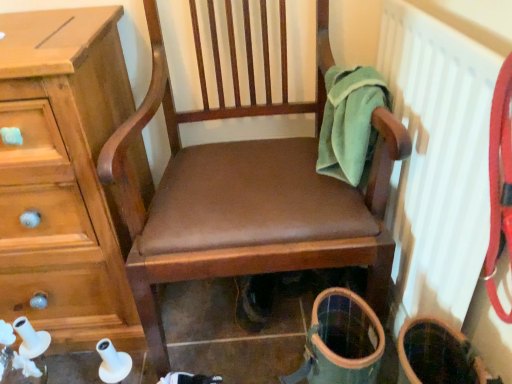
Question: Is brown leather chair at center shorter than green fleece towel at upper right?

Choices:
 (A) yes
 (B) no

Answer: (B)

Question: Can you confirm if brown leather chair at center is wider than green fleece towel at upper right?

Choices:
 (A) no
 (B) yes

Answer: (B)

Question: From the image's perspective, is brown leather chair at center located above green fleece towel at upper right?

Choices:
 (A) yes
 (B) no

Answer: (B)

Question: Is brown leather chair at center positioned with its back to green fleece towel at upper right?

Choices:
 (A) no
 (B) yes

Answer: (A)

Question: Could green fleece towel at upper right be considered to be inside brown leather chair at center?

Choices:
 (A) yes
 (B) no

Answer: (A)

Question: From a real-world perspective, is brown leather chair at center physically located above or below green fleece towel at upper right?

Choices:
 (A) below
 (B) above

Answer: (A)

Question: Is point (199, 190) positioned closer to the camera than point (324, 152)?

Choices:
 (A) closer
 (B) farther

Answer: (A)

Question: Is brown leather chair at center wider or thinner than green fleece towel at upper right?

Choices:
 (A) wide
 (B) thin

Answer: (A)

Question: Is brown leather chair at center taller or shorter than green fleece towel at upper right?

Choices:
 (A) tall
 (B) short

Answer: (A)

Question: Is white textured radiator at upper right in front of or behind green fleece towel at upper right in the image?

Choices:
 (A) front
 (B) behind

Answer: (A)

Question: From the image's perspective, is white textured radiator at upper right positioned above or below green fleece towel at upper right?

Choices:
 (A) above
 (B) below

Answer: (B)

Question: From a real-world perspective, relative to green fleece towel at upper right, is white textured radiator at upper right vertically above or below?

Choices:
 (A) above
 (B) below

Answer: (B)

Question: Considering the positions of point (468, 236) and point (350, 127), is point (468, 236) closer or farther from the camera than point (350, 127)?

Choices:
 (A) closer
 (B) farther

Answer: (A)

Question: Is green fleece towel at upper right bigger or smaller than brown leather chair at center?

Choices:
 (A) small
 (B) big

Answer: (A)

Question: From the image's perspective, relative to brown leather chair at center, is green fleece towel at upper right above or below?

Choices:
 (A) above
 (B) below

Answer: (A)